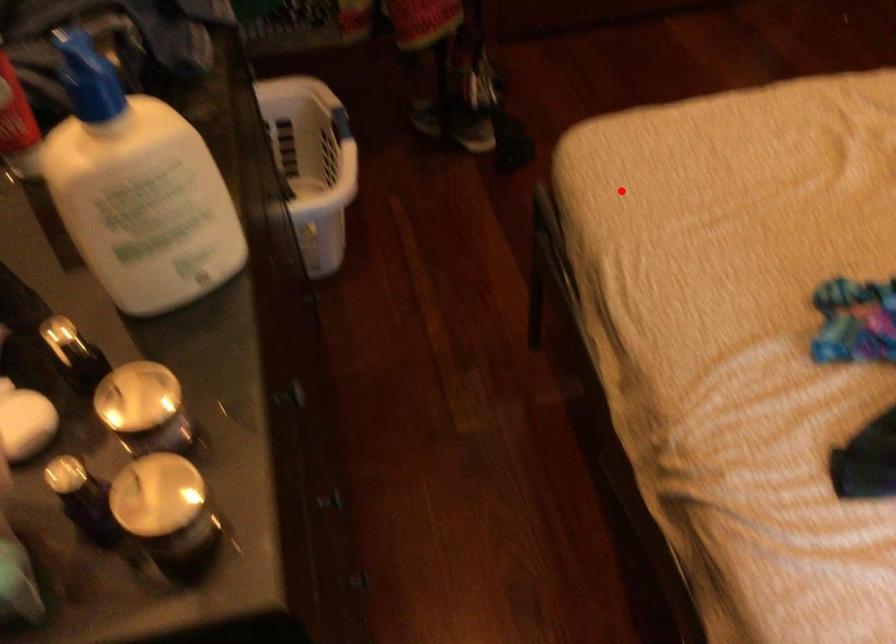
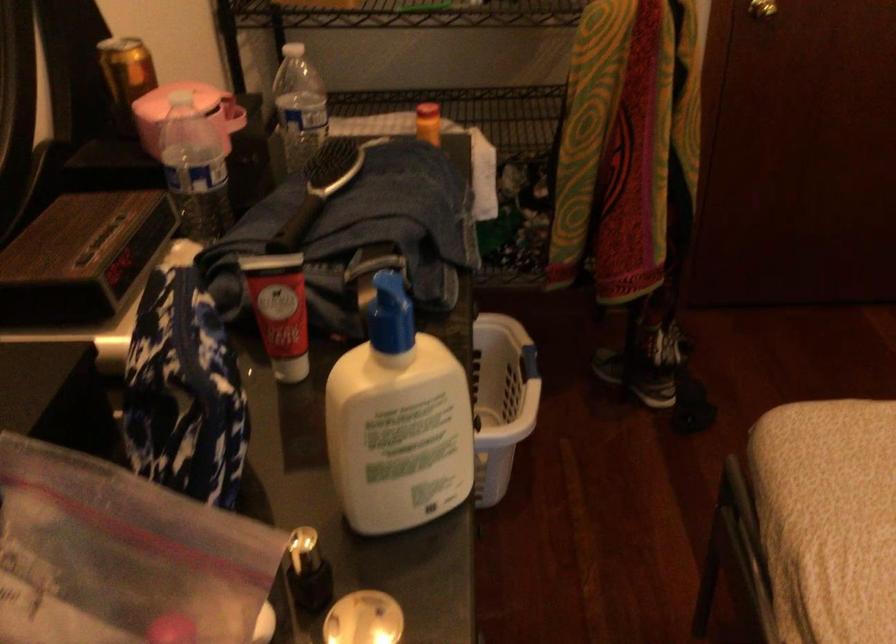
Locate, in the second image, the point that corresponds to the highlighted location in the first image.

(828, 488)